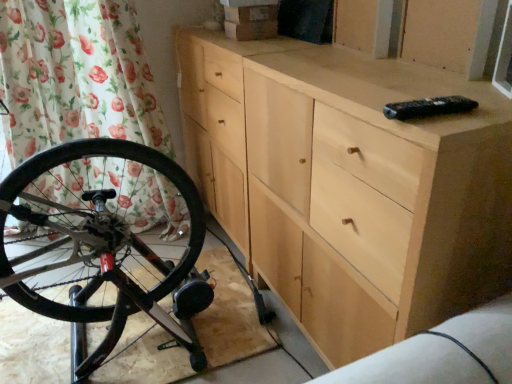
Question: Should I look upward or downward to see natural wood chest of drawers at center?

Choices:
 (A) down
 (B) up

Answer: (B)

Question: Is there a large distance between natural wood chest of drawers at center and clear glass window screen at upper right?

Choices:
 (A) no
 (B) yes

Answer: (A)

Question: Considering the relative sizes of natural wood chest of drawers at center and clear glass window screen at upper right in the image provided, is natural wood chest of drawers at center bigger than clear glass window screen at upper right?

Choices:
 (A) no
 (B) yes

Answer: (B)

Question: Is natural wood chest of drawers at center to the left of clear glass window screen at upper right from the viewer's perspective?

Choices:
 (A) no
 (B) yes

Answer: (B)

Question: Is natural wood chest of drawers at center surrounding clear glass window screen at upper right?

Choices:
 (A) no
 (B) yes

Answer: (A)

Question: From a real-world perspective, is natural wood chest of drawers at center physically below clear glass window screen at upper right?

Choices:
 (A) no
 (B) yes

Answer: (B)

Question: Considering the relative sizes of natural wood chest of drawers at center and clear glass window screen at upper right in the image provided, is natural wood chest of drawers at center smaller than clear glass window screen at upper right?

Choices:
 (A) yes
 (B) no

Answer: (B)

Question: Considering the relative sizes of floral fabric curtain at left and clear glass window screen at upper right in the image provided, is floral fabric curtain at left wider than clear glass window screen at upper right?

Choices:
 (A) yes
 (B) no

Answer: (A)

Question: Is clear glass window screen at upper right located within floral fabric curtain at left?

Choices:
 (A) no
 (B) yes

Answer: (A)

Question: From a real-world perspective, is floral fabric curtain at left positioned over clear glass window screen at upper right based on gravity?

Choices:
 (A) yes
 (B) no

Answer: (B)

Question: Is floral fabric curtain at left to the left of clear glass window screen at upper right from the viewer's perspective?

Choices:
 (A) yes
 (B) no

Answer: (A)

Question: Is floral fabric curtain at left positioned far away from clear glass window screen at upper right?

Choices:
 (A) yes
 (B) no

Answer: (A)

Question: Is floral fabric curtain at left facing away from clear glass window screen at upper right?

Choices:
 (A) yes
 (B) no

Answer: (B)

Question: Can you confirm if clear glass window screen at upper right is wider than natural wood chest of drawers at center?

Choices:
 (A) no
 (B) yes

Answer: (A)